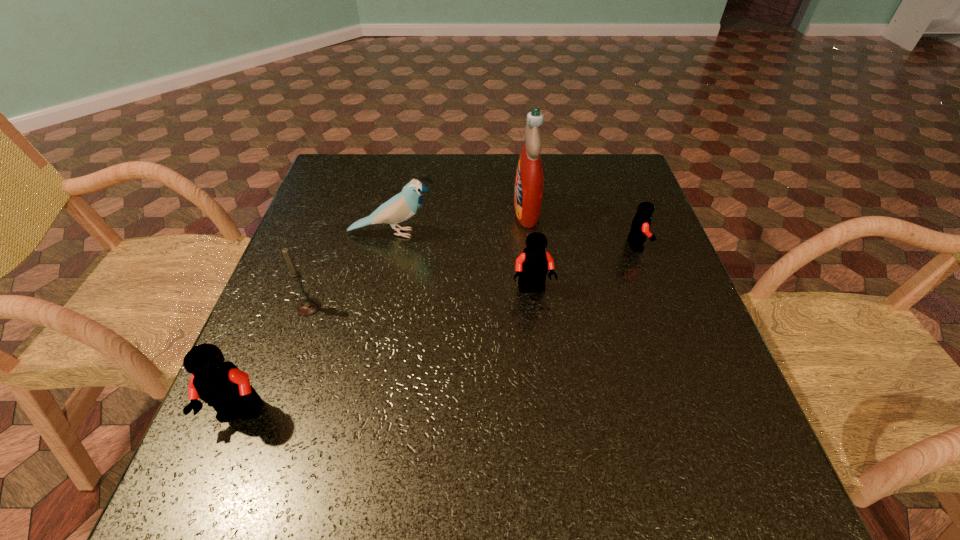
At what (x,y) coordinates should I click in order to perform the action: click on the nearest object. Please return your answer as a coordinate pair (x, y). Looking at the image, I should click on (219, 383).

This screenshot has height=540, width=960. In order to click on the nearest Lego in this screenshot , I will do `click(219, 383)`.

At what (x,y) coordinates should I click in order to perform the action: click on the second shortest Lego. Please return your answer as a coordinate pair (x, y). Looking at the image, I should click on (532, 265).

Locate an element on the screen. The image size is (960, 540). the second nearest Lego is located at coordinates (532, 265).

At what (x,y) coordinates should I click in order to perform the action: click on the farthest Lego. Please return your answer as a coordinate pair (x, y). The image size is (960, 540). Looking at the image, I should click on (640, 226).

I want to click on the shortest Lego, so click(x=640, y=226).

The width and height of the screenshot is (960, 540). In order to click on the fourth object from right to left in this screenshot , I will do `click(401, 207)`.

The width and height of the screenshot is (960, 540). In order to click on detergent in this screenshot , I will do click(x=528, y=192).

You are a GUI agent. You are given a task and a screenshot of the screen. Output one action in this format:
    pyautogui.click(x=<x>, y=<y>)
    Task: Click on the candle
    
    Given the screenshot: What is the action you would take?
    pyautogui.click(x=307, y=306)

At what (x,y) coordinates should I click in order to perform the action: click on free location located on the front-facing side of the second farthest Lego. Please return your answer as a coordinate pair (x, y). This screenshot has height=540, width=960. Looking at the image, I should click on (541, 367).